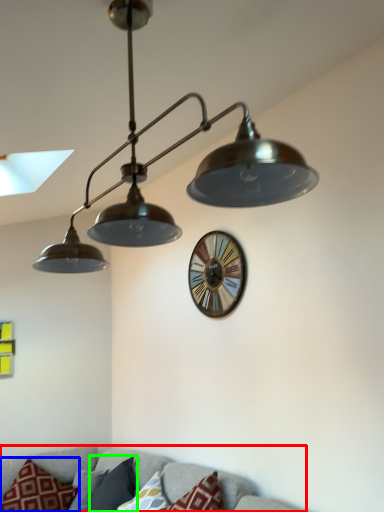
Question: Which is farther away from couch (highlighted by a red box)? pillow (highlighted by a blue box) or pillow (highlighted by a green box)?

Choices:
 (A) pillow
 (B) pillow

Answer: (A)